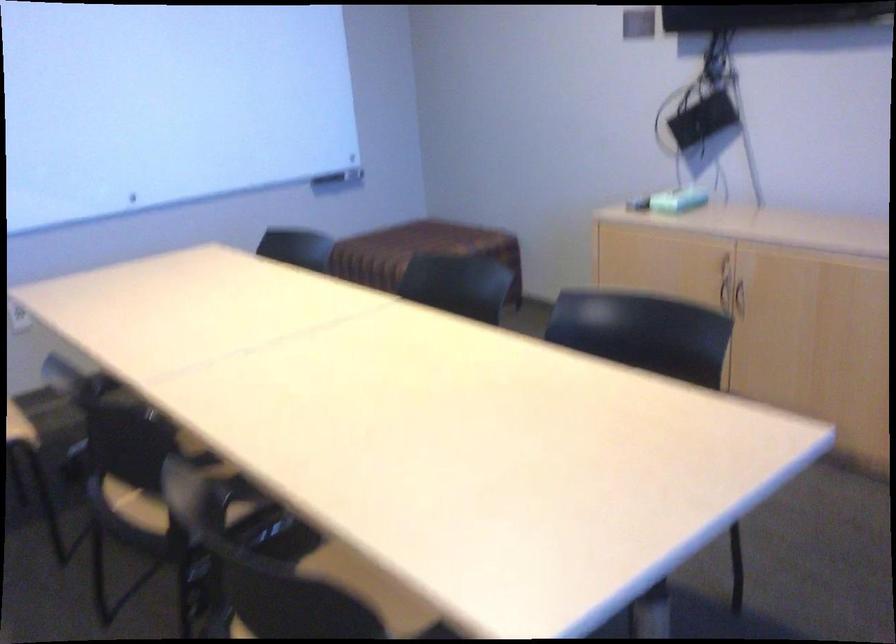
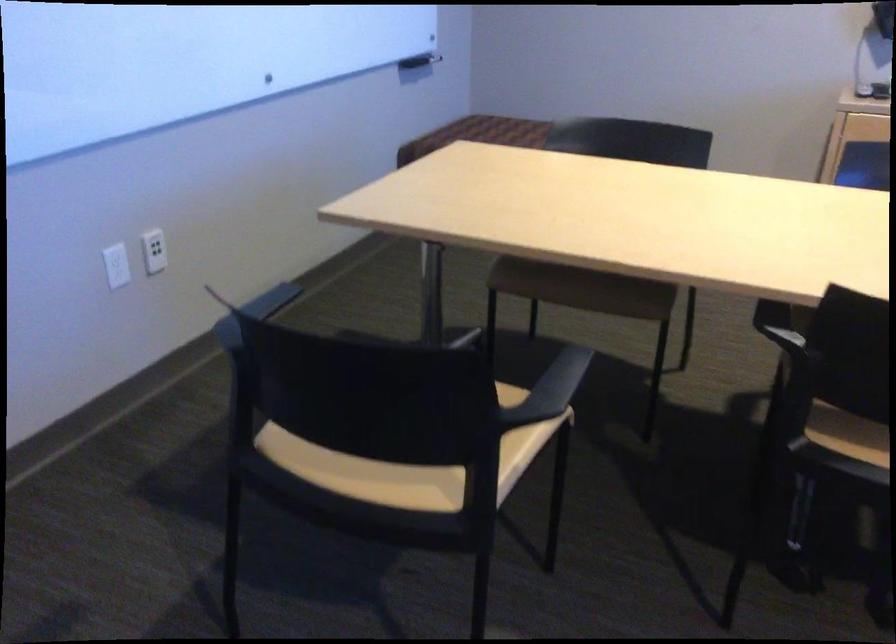
What movement of the cameraman would produce the second image?

The cameraman walked toward left, forward.